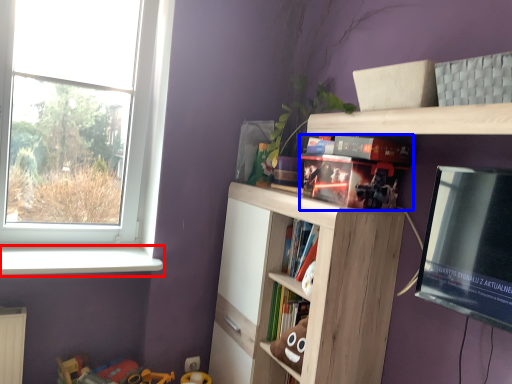
Question: Which object appears farthest to the camera in this image, window sill (highlighted by a red box) or book (highlighted by a blue box)?

Choices:
 (A) window sill
 (B) book

Answer: (A)